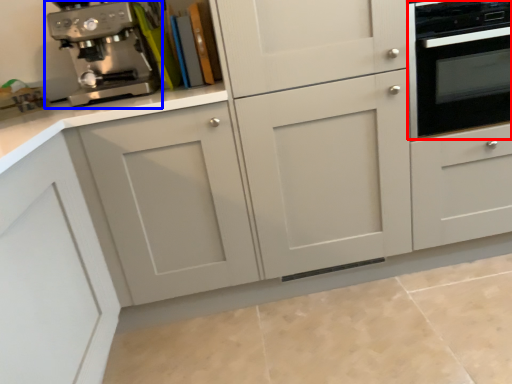
Question: Which of the following is the farthest to the observer, home appliance (highlighted by a red box) or coffee maker (highlighted by a blue box)?

Choices:
 (A) home appliance
 (B) coffee maker

Answer: (B)